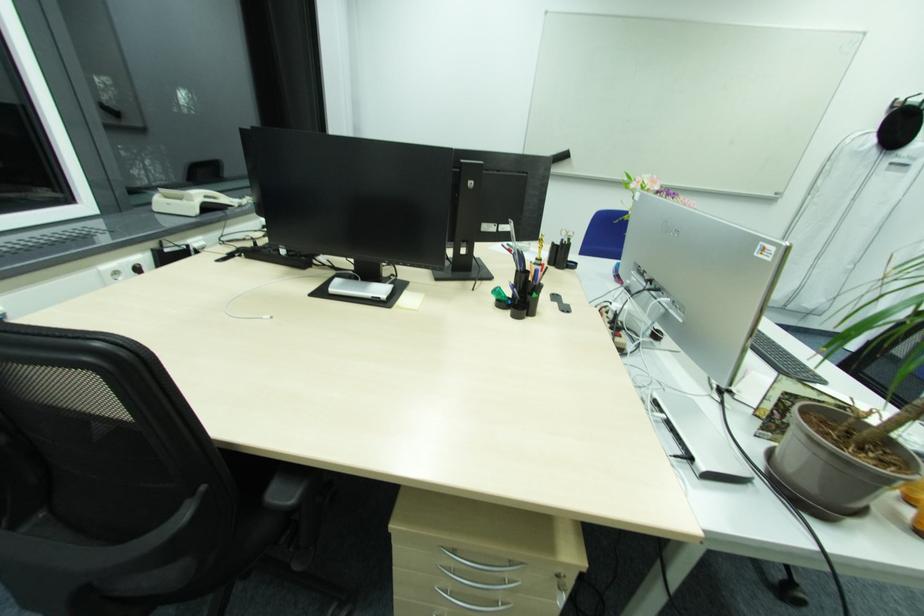
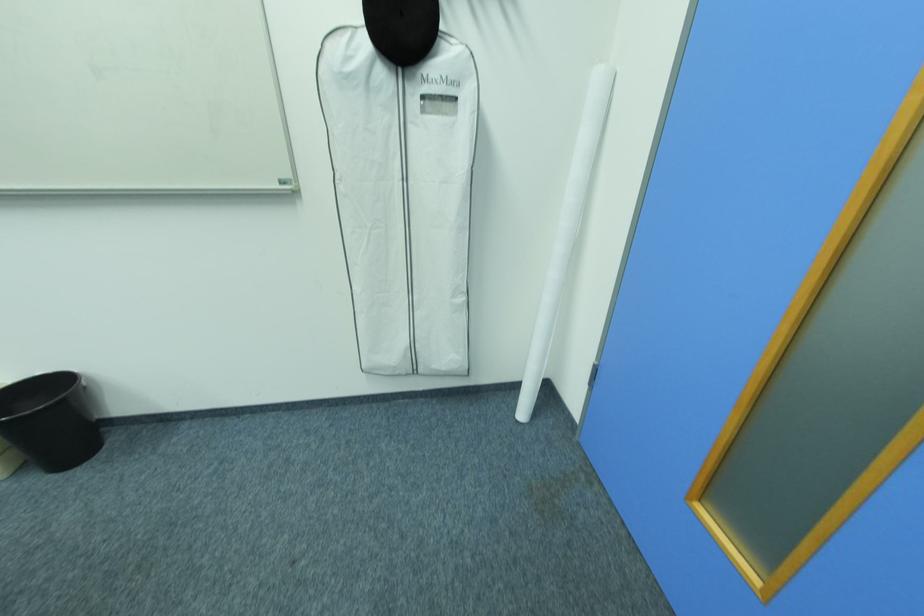
The point at (823, 257) is marked in the first image. Where is the corresponding point in the second image?

(416, 292)